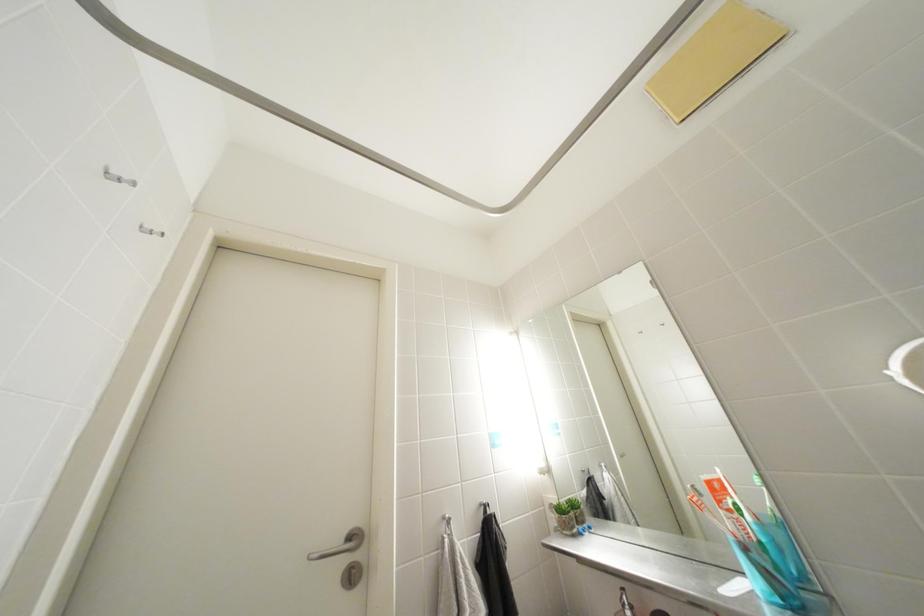
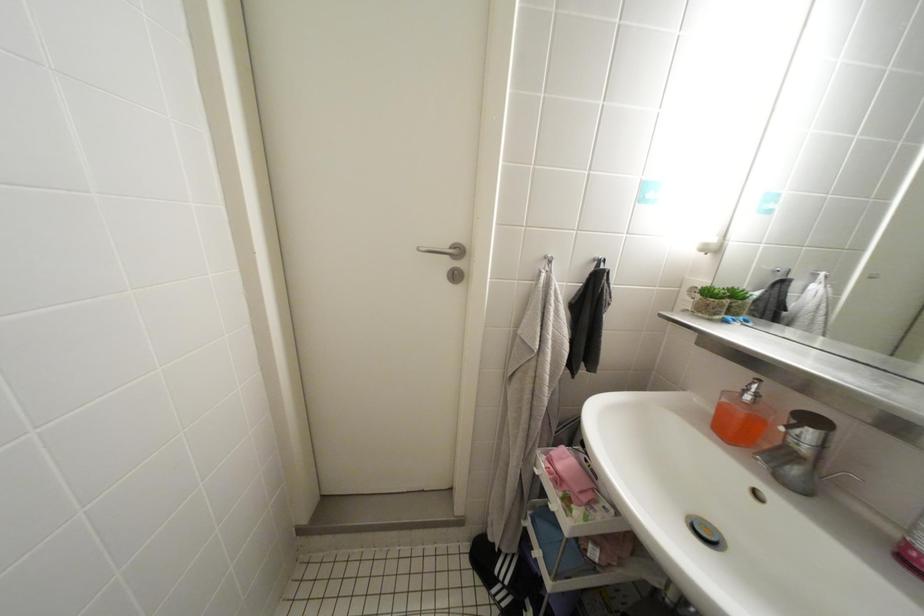
The first image is from the beginning of the video and the second image is from the end. How did the camera likely rotate when shooting the video?

The rotation direction of the camera is left-down.